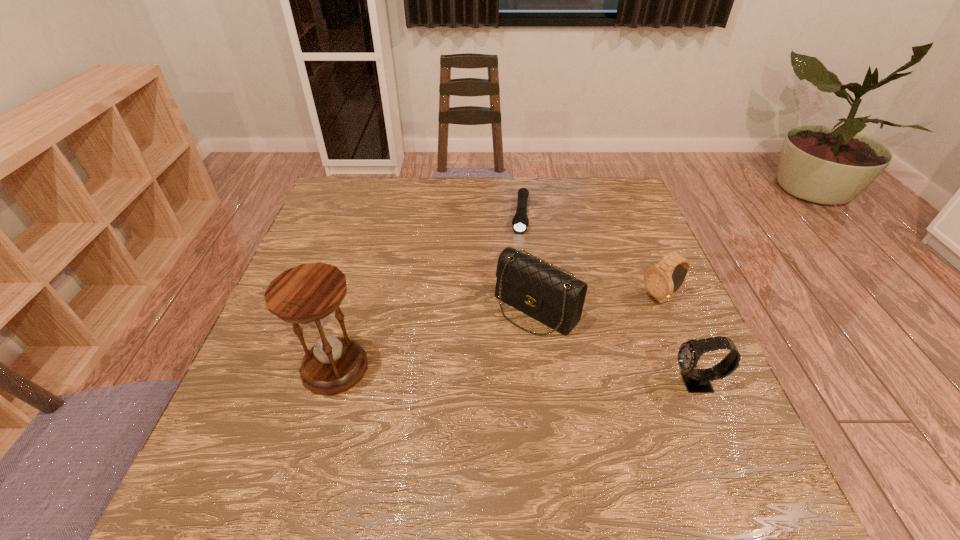
This screenshot has height=540, width=960. I want to click on vacant area between the clutch bag and the tallest object, so click(436, 338).

Identify the location of vacant space that is in between the nearer watch and the shortest object. [609, 299].

I want to click on free area in between the hourglass and the farther watch, so click(498, 333).

You are a GUI agent. You are given a task and a screenshot of the screen. Output one action in this format:
    pyautogui.click(x=<x>, y=<y>)
    Task: Click on the vacant space in between the leftmost object and the farther watch
    The height and width of the screenshot is (540, 960).
    Given the screenshot: What is the action you would take?
    pyautogui.click(x=498, y=333)

Where is `free space between the nearer watch and the farther watch`? Image resolution: width=960 pixels, height=540 pixels. free space between the nearer watch and the farther watch is located at coordinates (679, 341).

In order to click on free space between the tallest object and the farther watch in this screenshot , I will do `click(498, 333)`.

Locate an element on the screen. The width and height of the screenshot is (960, 540). empty location between the tallest object and the farther watch is located at coordinates (498, 333).

Locate an element on the screen. The height and width of the screenshot is (540, 960). object identified as the second closest to the nearer watch is located at coordinates (529, 284).

Locate which object ranks fourth in proximity to the farthest object. Please provide its 2D coordinates. Your answer should be formatted as a tuple, i.e. [(x, y)], where the tuple contains the x and y coordinates of a point satisfying the conditions above.

[(696, 380)]

Find the location of a particular element. vacant area in the image that satisfies the following two spatial constraints: 1. on the back side of the hourglass; 2. on the right side of the flashlight is located at coordinates (379, 215).